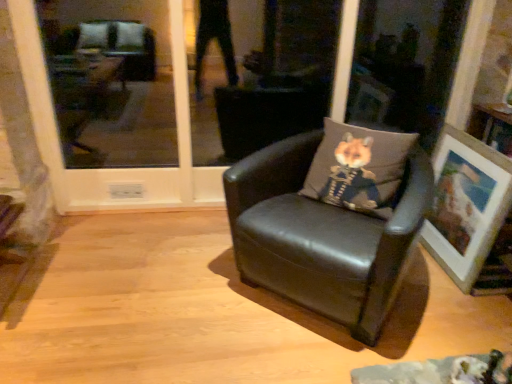
Question: Does point (44, 139) appear closer or farther from the camera than point (396, 286)?

Choices:
 (A) closer
 (B) farther

Answer: (B)

Question: Would you say transparent glass door at center is inside or outside black leather chair at center?

Choices:
 (A) outside
 (B) inside

Answer: (A)

Question: Estimate the real-world distances between objects in this image. Which object is closer to the black leather chair at center?

Choices:
 (A) gray fabric pillow with fox print at center
 (B) wooden picture frame at right
 (C) transparent glass door at center

Answer: (A)

Question: Which is farther from the wooden picture frame at right?

Choices:
 (A) black leather chair at center
 (B) gray fabric pillow with fox print at center
 (C) transparent glass door at center

Answer: (C)